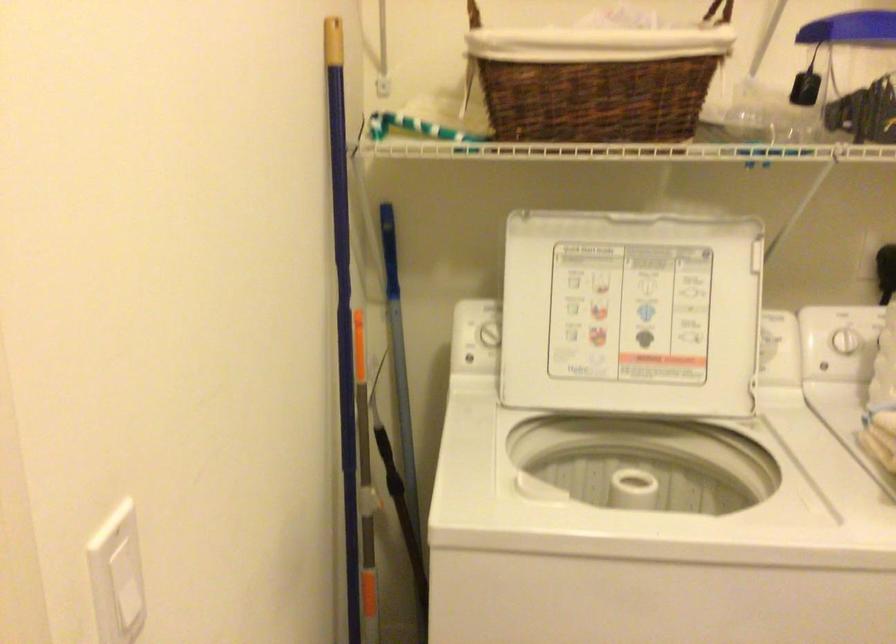
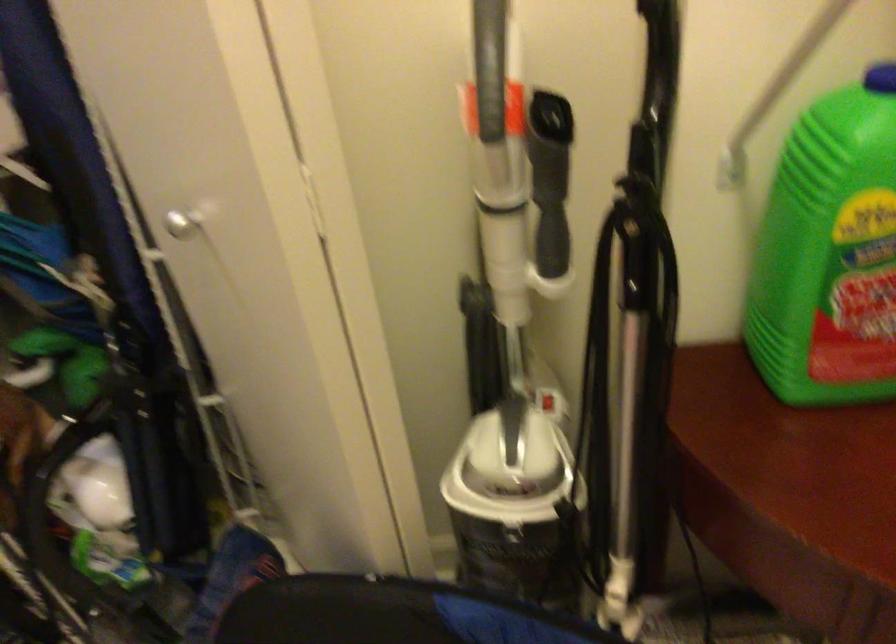
How did the camera likely rotate?

The camera rotated toward right-down.